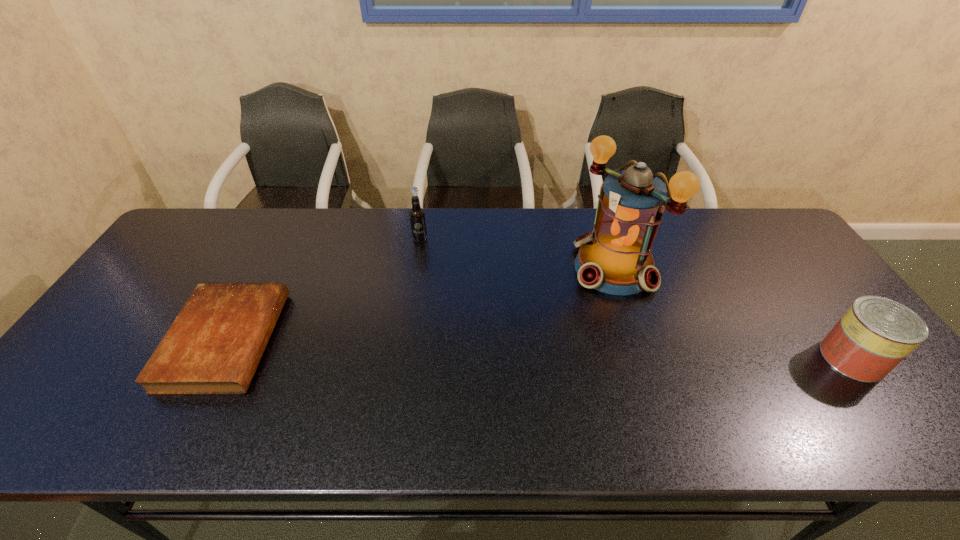
Locate an element on the screen. free space on the desktop that is between the Bible and the rightmost object and is positioned on the front-facing side of the lantern is located at coordinates (499, 348).

The image size is (960, 540). I want to click on vacant spot on the desktop that is between the leftmost object and the can and is positioned on the label of the third shortest object, so click(x=444, y=347).